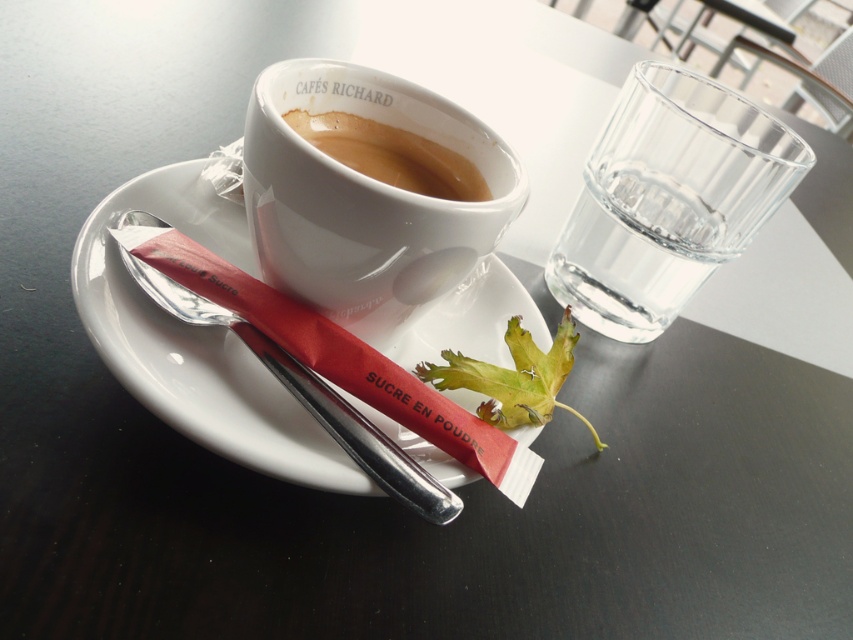
You are a barista preparing drinks and need to choose between the white ceramic mug at upper center and the transparent glass at upper right for a customer who wants a drink with more volume. Which object should you choose?

The transparent glass at upper right has a greater width than the white ceramic mug at upper center, so it can hold more volume and is the better choice.

You are a barista trying to place both the white ceramic mug at upper center and the transparent glass at upper right on a shelf. Which object should you place first if you want to maximize the shelf space?

You should place the transparent glass at upper right first because it occupies more space than the white ceramic mug at upper center, allowing you to fit the smaller mug afterward.